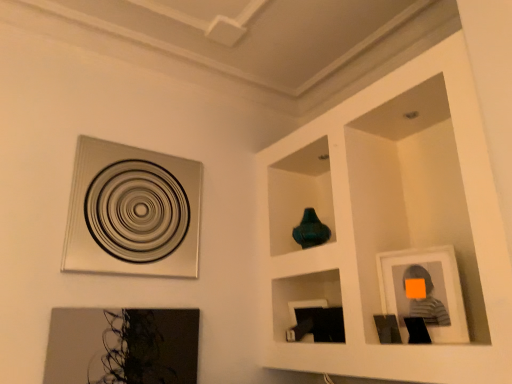
Question: Is metallic silver picture frame at upper left, the first picture frame in the left-to-right sequence, thinner than matte gray picture frame at right, the first picture frame when ordered from right to left?

Choices:
 (A) yes
 (B) no

Answer: (B)

Question: From the image's perspective, is metallic silver picture frame at upper left, the first picture frame in the left-to-right sequence, above matte gray picture frame at right, which is the 3th picture frame in left-to-right order?

Choices:
 (A) yes
 (B) no

Answer: (A)

Question: Can you confirm if metallic silver picture frame at upper left, the first picture frame in the left-to-right sequence, is shorter than matte gray picture frame at right, the first picture frame when ordered from right to left?

Choices:
 (A) no
 (B) yes

Answer: (A)

Question: From a real-world perspective, is metallic silver picture frame at upper left, acting as the third picture frame starting from the right, under matte gray picture frame at right, the first picture frame when ordered from right to left?

Choices:
 (A) no
 (B) yes

Answer: (A)

Question: From a real-world perspective, does metallic silver picture frame at upper left, the first picture frame in the left-to-right sequence, stand above matte gray picture frame at right, which is the 3th picture frame in left-to-right order?

Choices:
 (A) yes
 (B) no

Answer: (A)

Question: Do you think matte black picture frame at lower left, the 2th picture frame in the left-to-right sequence, is within metallic silver picture frame at upper left, acting as the third picture frame starting from the right, or outside of it?

Choices:
 (A) outside
 (B) inside

Answer: (A)

Question: Is point (143, 334) closer or farther from the camera than point (129, 188)?

Choices:
 (A) farther
 (B) closer

Answer: (B)

Question: Considering the positions of matte black picture frame at lower left, the 2th picture frame in the left-to-right sequence, and metallic silver picture frame at upper left, acting as the third picture frame starting from the right, in the image, is matte black picture frame at lower left, the 2th picture frame in the left-to-right sequence, taller or shorter than metallic silver picture frame at upper left, acting as the third picture frame starting from the right,?

Choices:
 (A) short
 (B) tall

Answer: (A)

Question: Relative to metallic silver picture frame at upper left, acting as the third picture frame starting from the right, is matte black picture frame at lower left, the 2th picture frame in the left-to-right sequence, in front or behind?

Choices:
 (A) front
 (B) behind

Answer: (A)

Question: Does point (118, 238) appear closer or farther from the camera than point (181, 332)?

Choices:
 (A) farther
 (B) closer

Answer: (B)

Question: Considering their positions, is metallic silver picture frame at upper left, acting as the third picture frame starting from the right, located in front of or behind matte black picture frame at lower left, the 2th picture frame in the right-to-left sequence?

Choices:
 (A) front
 (B) behind

Answer: (B)

Question: Considering the positions of metallic silver picture frame at upper left, the first picture frame in the left-to-right sequence, and matte black picture frame at lower left, the 2th picture frame in the right-to-left sequence, in the image, is metallic silver picture frame at upper left, the first picture frame in the left-to-right sequence, wider or thinner than matte black picture frame at lower left, the 2th picture frame in the right-to-left sequence,?

Choices:
 (A) thin
 (B) wide

Answer: (B)

Question: From the image's perspective, is metallic silver picture frame at upper left, the first picture frame in the left-to-right sequence, above or below matte black picture frame at lower left, the 2th picture frame in the right-to-left sequence?

Choices:
 (A) below
 (B) above

Answer: (B)

Question: Is metallic silver picture frame at upper left, acting as the third picture frame starting from the right, inside or outside of matte gray picture frame at right, which is the 3th picture frame in left-to-right order?

Choices:
 (A) inside
 (B) outside

Answer: (B)

Question: In the image, is metallic silver picture frame at upper left, the first picture frame in the left-to-right sequence, on the left side or the right side of matte gray picture frame at right, which is the 3th picture frame in left-to-right order?

Choices:
 (A) right
 (B) left

Answer: (B)